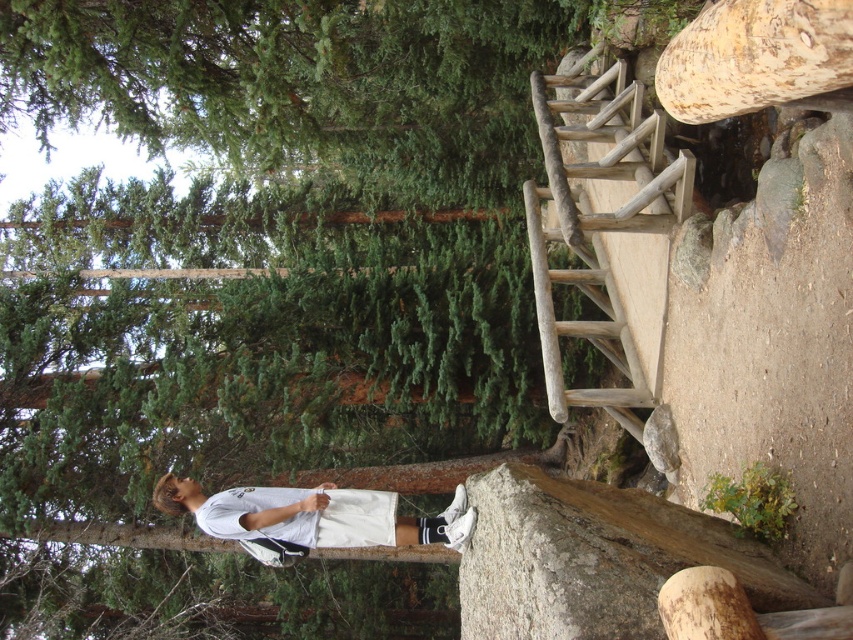
Is green matte tree trunk at center below white matte shorts at lower center?

No, green matte tree trunk at center is not below white matte shorts at lower center.

Is green matte tree trunk at center bigger than white matte shorts at lower center?

Yes.

Locate an element on the screen. green matte tree trunk at center is located at coordinates (271, 243).

Is green matte tree trunk at center wider than natural wood ladder at upper right?

Correct, the width of green matte tree trunk at center exceeds that of natural wood ladder at upper right.

Can you confirm if green matte tree trunk at center is thinner than natural wood ladder at upper right?

In fact, green matte tree trunk at center might be wider than natural wood ladder at upper right.

Is point (74, 378) closer to camera compared to point (683, 192)?

That is False.

Locate an element on the screen. The width and height of the screenshot is (853, 640). green matte tree trunk at center is located at coordinates (271, 243).

Is natural wood ladder at upper right positioned behind white matte shorts at lower center?

Yes, natural wood ladder at upper right is behind white matte shorts at lower center.

Is natural wood ladder at upper right to the left of white matte shorts at lower center from the viewer's perspective?

No, natural wood ladder at upper right is not to the left of white matte shorts at lower center.

The width and height of the screenshot is (853, 640). Identify the location of natural wood ladder at upper right. (599, 221).

Identify the location of natural wood ladder at upper right. Image resolution: width=853 pixels, height=640 pixels. (599, 221).